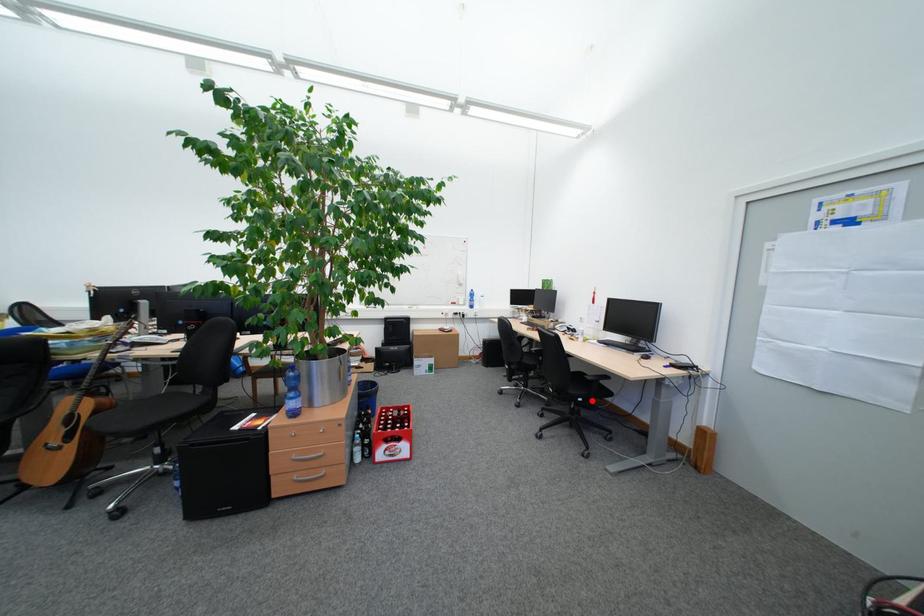
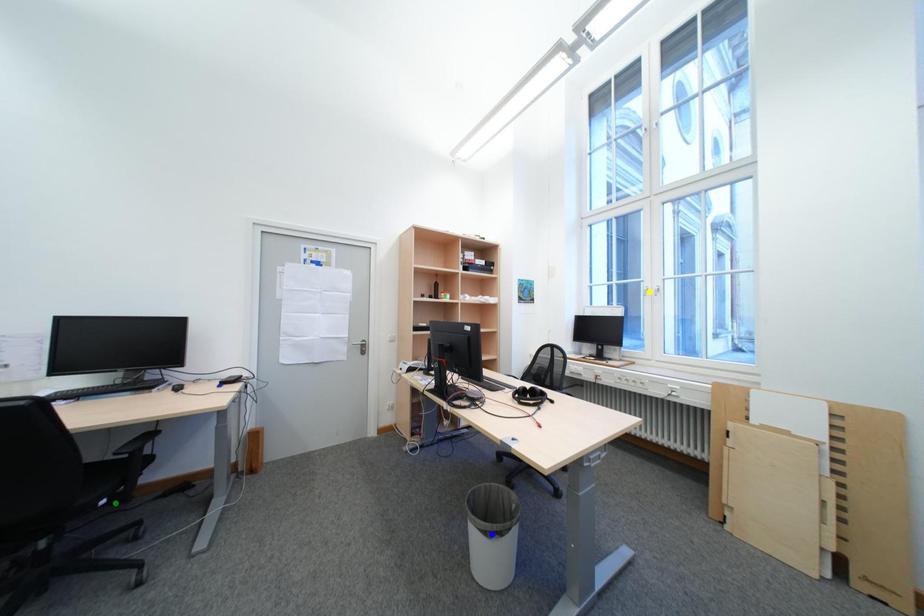
Question: I am providing you with two images of the same scene from different viewpoints. A red point is marked on the first image. You are given multiple points on the second image. In image 2, which mark is for the same physical point as the one in image 1?

Choices:
 (A) green point
 (B) yellow point
 (C) blue point

Answer: (A)